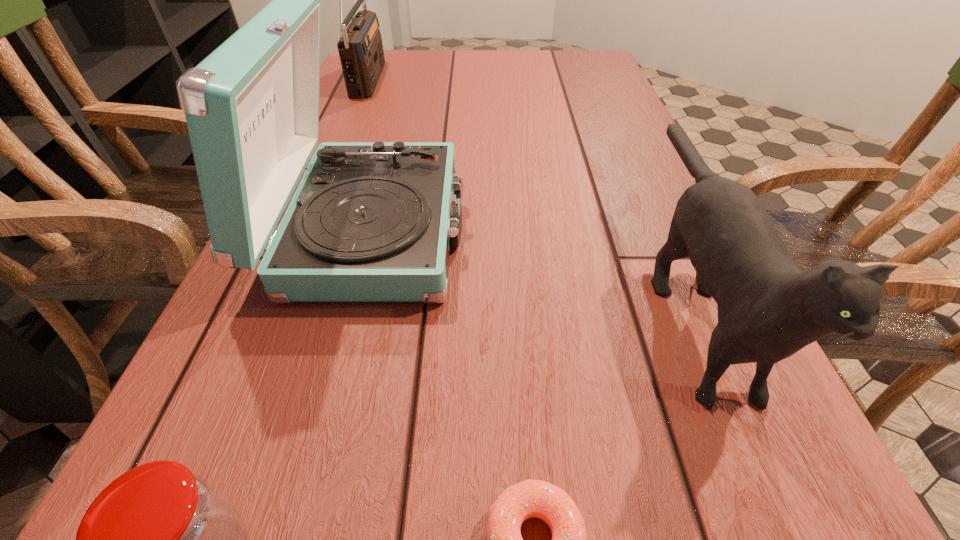
Image resolution: width=960 pixels, height=540 pixels. Find the location of `the farthest object`. the farthest object is located at coordinates (360, 47).

At what (x,y) coordinates should I click in order to perform the action: click on record player. Please return your answer as a coordinate pair (x, y). The image size is (960, 540). Looking at the image, I should click on (370, 221).

This screenshot has height=540, width=960. What are the coordinates of `the third shortest object` in the screenshot? It's located at pyautogui.click(x=768, y=309).

Identify the location of cat. (768, 309).

Identify the location of vacant point located 0.310m on the front-facing side of the farthest object. (489, 77).

The image size is (960, 540). Identify the location of blank space located 0.200m on the face side of the record player. (576, 228).

Where is `vacant space situated 0.090m on the front-facing side of the third shortest object`? The height and width of the screenshot is (540, 960). vacant space situated 0.090m on the front-facing side of the third shortest object is located at coordinates (790, 536).

This screenshot has height=540, width=960. Identify the location of object that is at the far edge. (360, 47).

The height and width of the screenshot is (540, 960). I want to click on radio receiver located in the left edge section of the desktop, so click(360, 47).

At what (x,y) coordinates should I click in order to perform the action: click on record player that is at the left edge. Please return your answer as a coordinate pair (x, y). This screenshot has height=540, width=960. Looking at the image, I should click on (370, 221).